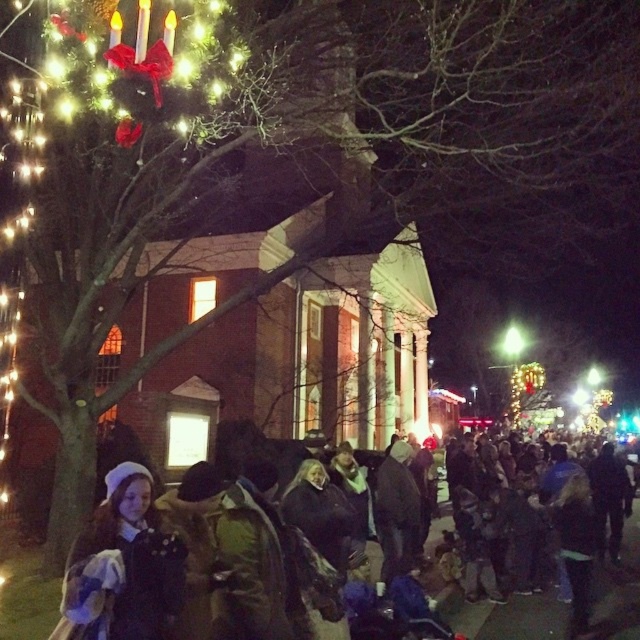
You are standing in the crowd at the festive event and want to take a photo. You notice two points in the scene labeled as point 1 at coordinates point 1 at coordinates point (x=104, y=589) and point 2 at coordinates point (x=177, y=531). Which point is closer to your camera when taking the photo?

Point (x=104, y=589) is closer to the camera than point (x=177, y=531).

You are a photographer at the event and want to capture a photo of the crowd. You notice the velvet blue coat at lower left and the dark woolen coat at lower left. Which coat is covering part of the other?

The velvet blue coat at lower left is positioned over the dark woolen coat at lower left, so it is covering part of it.

You are organizing a coat check at the event and need to know which coat requires less space to store. Based on the image, which coat between the velvet blue coat at lower left and the dark woolen coat at lower left takes up less space?

The velvet blue coat at lower left takes up less space because its width is less than the dark woolen coat at lower left.